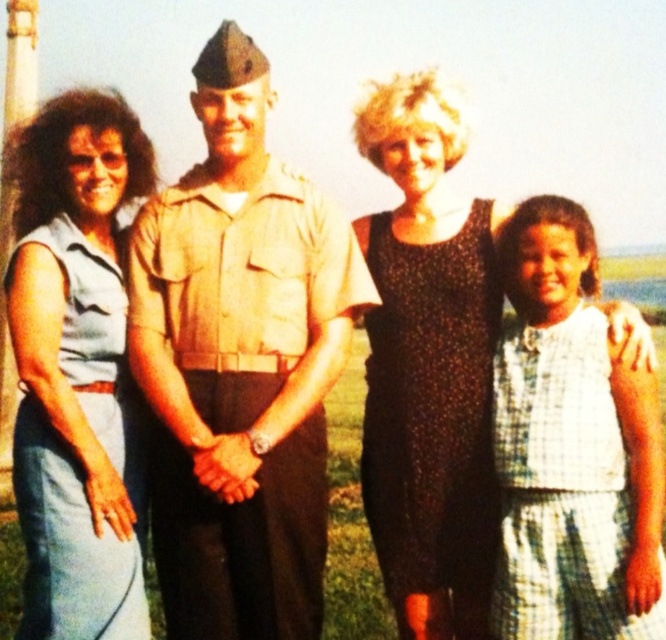
You are planning to take a photo of the khaki uniform at center and the white checkered dress at right. Which one do you think will appear bigger in the photo?

The khaki uniform at center will appear bigger in the photo because it has a larger size compared to the white checkered dress at right.

You are a photographer trying to capture a clear shot of both the khaki uniform at center and the blue denim dress at left. Which subject should you focus on first to ensure both are in focus?

You should focus on the khaki uniform at center first since it is closer to the viewer than the blue denim dress at left, allowing the camera to adjust focus for the closer subject before the farther one.